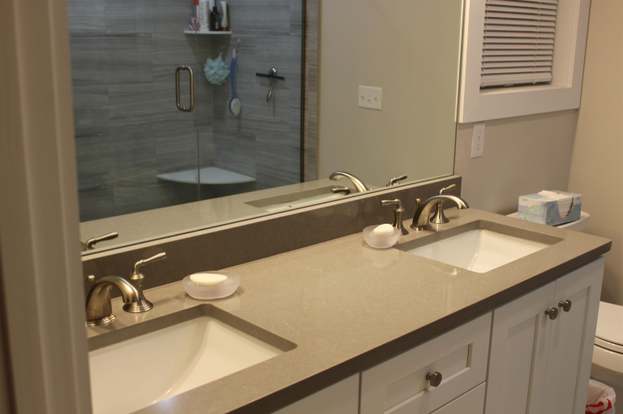
The width and height of the screenshot is (623, 414). Identify the location of toilet cover. (609, 321).